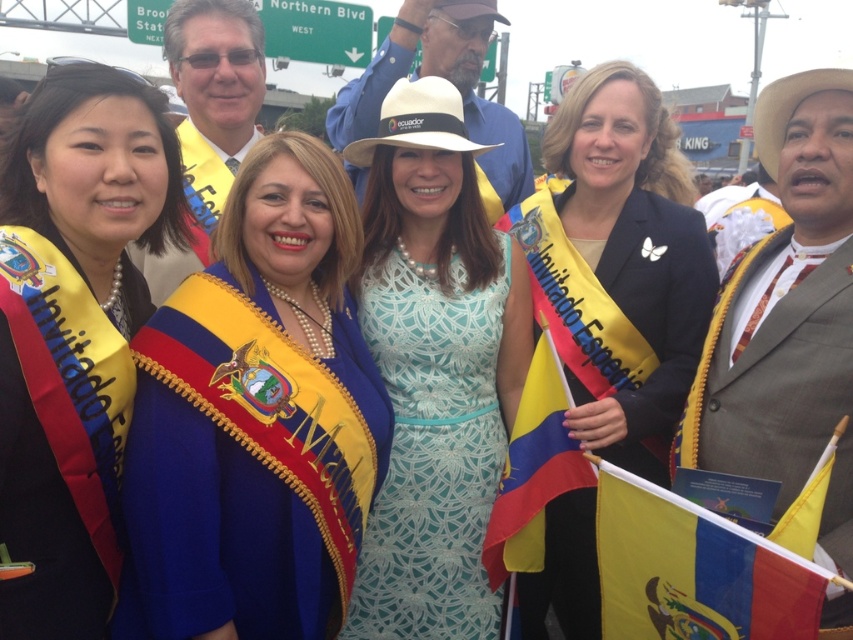
You are a photographer trying to capture a closeup of the blue satin sash at left and the yellow fabric flag at lower right. Since you can only focus on one object at a time, which one should you choose to ensure it appears larger in the photo?

The yellow fabric flag at lower right is larger than the blue satin sash at left, so focusing on it will make it appear bigger in the photo.